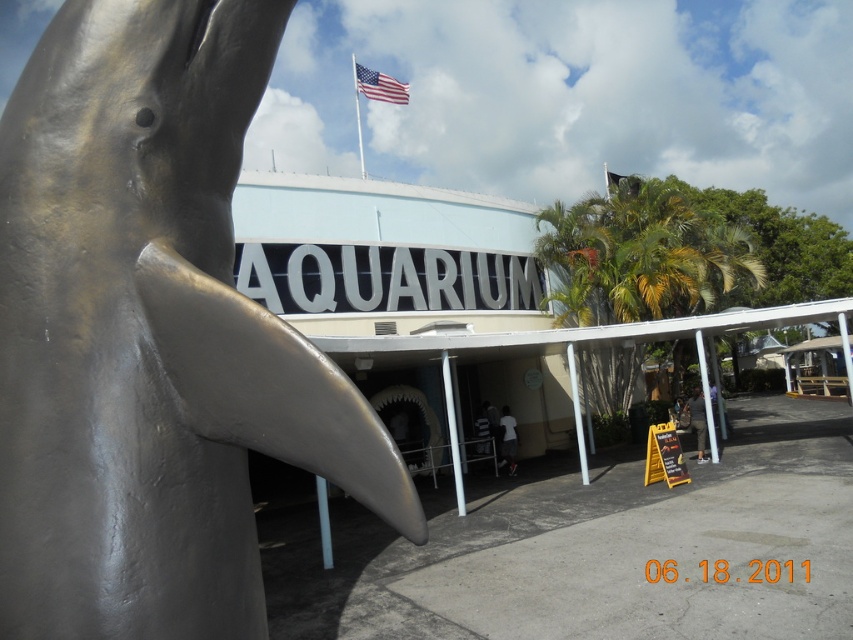
Who is positioned more to the left, shiny silver dolphin at left or american flag at upper center?

american flag at upper center

Does shiny silver dolphin at left appear on the right side of american flag at upper center?

Yes, shiny silver dolphin at left is to the right of american flag at upper center.

Which is in front, point (22, 369) or point (379, 77)?

Point (22, 369) is more forward.

The width and height of the screenshot is (853, 640). What are the coordinates of `shiny silver dolphin at left` in the screenshot? It's located at (149, 336).